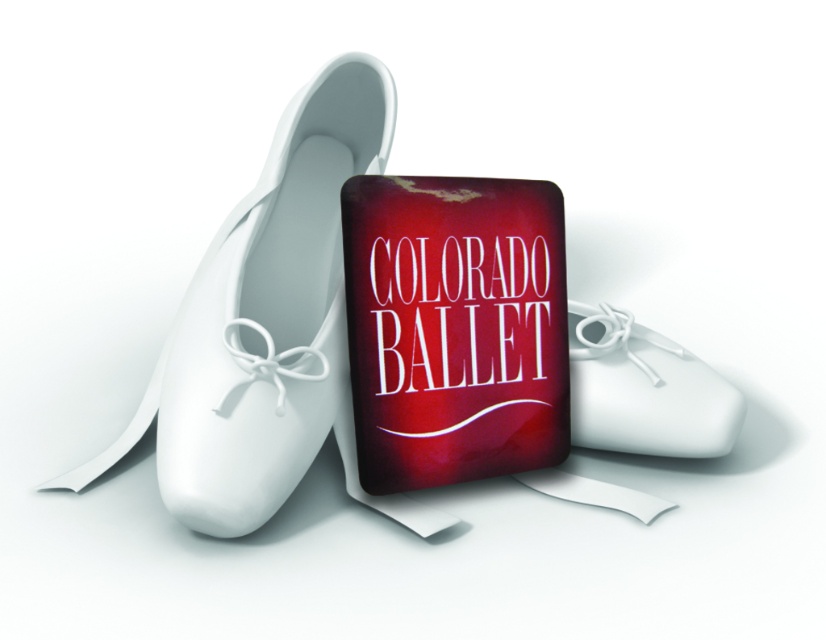
Question: Which point is closer to the camera taking this photo?

Choices:
 (A) (319, 365)
 (B) (603, 358)

Answer: (A)

Question: Can you confirm if matte white ballet shoe at center is positioned to the left of white matte ballet shoe at center?

Choices:
 (A) no
 (B) yes

Answer: (B)

Question: Which point is farther to the camera?

Choices:
 (A) matte white ballet shoe at center
 (B) white matte ballet shoe at center

Answer: (B)

Question: Can you confirm if matte white ballet shoe at center is wider than white matte ballet shoe at center?

Choices:
 (A) yes
 (B) no

Answer: (A)

Question: From the image, what is the correct spatial relationship of matte white ballet shoe at center in relation to white matte ballet shoe at center?

Choices:
 (A) left
 (B) right

Answer: (A)